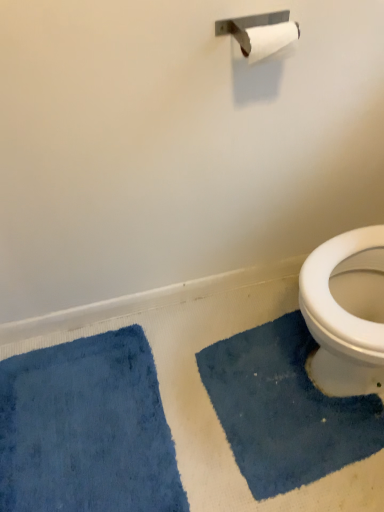
You are a GUI agent. You are given a task and a screenshot of the screen. Output one action in this format:
    pyautogui.click(x=<x>, y=<y>)
    Task: Click on the free location above blue plush bath mat at lower right, the second bath mat from the left (from a real-world perspective)
    The height and width of the screenshot is (512, 384).
    Given the screenshot: What is the action you would take?
    point(287,392)